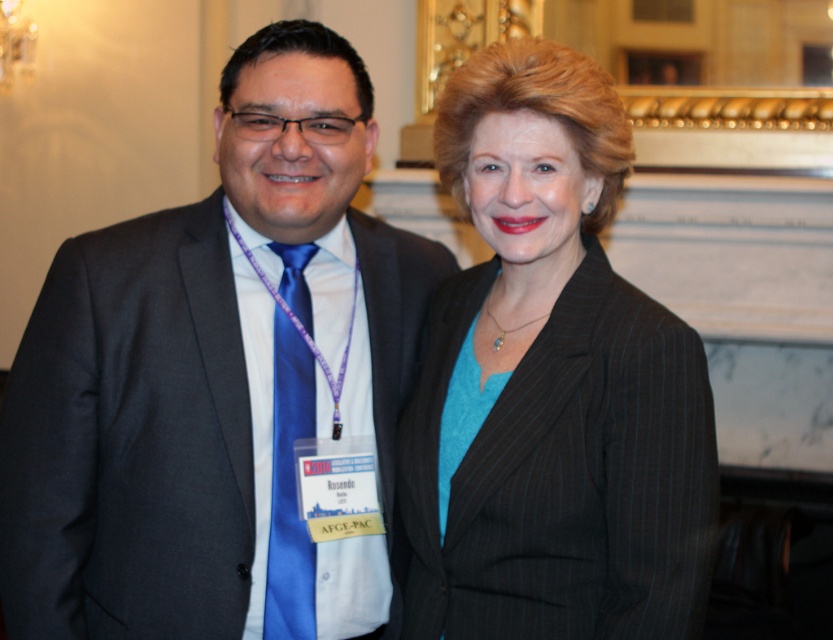
Question: Which object appears farthest from the camera in this image?

Choices:
 (A) matte black suit at center
 (B) matte black blazer at center
 (C) blue silk tie at left

Answer: (C)

Question: Which point is farther to the camera?

Choices:
 (A) (208, 204)
 (B) (275, 538)

Answer: (A)

Question: Does matte black suit at center appear over matte black blazer at center?

Choices:
 (A) no
 (B) yes

Answer: (A)

Question: Which point is closer to the camera taking this photo?

Choices:
 (A) (131, 525)
 (B) (273, 577)
 (C) (576, 464)

Answer: (C)

Question: Is matte black blazer at center positioned at the back of blue silk tie at left?

Choices:
 (A) no
 (B) yes

Answer: (A)

Question: Observing the image, what is the correct spatial positioning of matte black suit at center in reference to matte black blazer at center?

Choices:
 (A) below
 (B) above

Answer: (A)